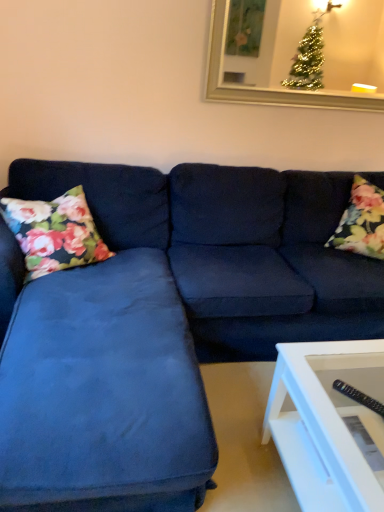
Question: Should I look upward or downward to see floral fabric pillow at left, which ranks as the first pillow in left-to-right order?

Choices:
 (A) up
 (B) down

Answer: (A)

Question: Is suede blue couch at center not inside floral fabric pillow at right, which ranks as the second pillow in left-to-right order?

Choices:
 (A) yes
 (B) no

Answer: (A)

Question: Considering the relative positions of suede blue couch at center and floral fabric pillow at right, which ranks as the second pillow in left-to-right order, in the image provided, is suede blue couch at center behind floral fabric pillow at right, which ranks as the second pillow in left-to-right order,?

Choices:
 (A) yes
 (B) no

Answer: (B)

Question: Would you consider suede blue couch at center to be distant from floral fabric pillow at right, the first pillow viewed from the right?

Choices:
 (A) yes
 (B) no

Answer: (B)

Question: Could floral fabric pillow at right, the first pillow viewed from the right, be considered to be inside suede blue couch at center?

Choices:
 (A) yes
 (B) no

Answer: (A)

Question: Is suede blue couch at center oriented towards floral fabric pillow at right, which ranks as the second pillow in left-to-right order?

Choices:
 (A) yes
 (B) no

Answer: (B)

Question: From a real-world perspective, is suede blue couch at center on top of floral fabric pillow at right, the first pillow viewed from the right?

Choices:
 (A) no
 (B) yes

Answer: (A)

Question: Can you confirm if gold-framed mirror at upper center is thinner than floral fabric pillow at right, which ranks as the second pillow in left-to-right order?

Choices:
 (A) no
 (B) yes

Answer: (B)

Question: Would you say gold-framed mirror at upper center is a long distance from floral fabric pillow at right, which ranks as the second pillow in left-to-right order?

Choices:
 (A) no
 (B) yes

Answer: (B)

Question: Does gold-framed mirror at upper center have a lesser height compared to floral fabric pillow at right, the first pillow viewed from the right?

Choices:
 (A) no
 (B) yes

Answer: (B)

Question: From a real-world perspective, is gold-framed mirror at upper center positioned over floral fabric pillow at right, the first pillow viewed from the right, based on gravity?

Choices:
 (A) no
 (B) yes

Answer: (B)

Question: Is gold-framed mirror at upper center next to floral fabric pillow at right, the first pillow viewed from the right, and touching it?

Choices:
 (A) yes
 (B) no

Answer: (B)

Question: Is gold-framed mirror at upper center taller than floral fabric pillow at right, the first pillow viewed from the right?

Choices:
 (A) yes
 (B) no

Answer: (B)

Question: Considering the relative sizes of floral fabric pillow at left, placed as the 2th pillow when sorted from right to left, and floral fabric pillow at right, the first pillow viewed from the right, in the image provided, is floral fabric pillow at left, placed as the 2th pillow when sorted from right to left, shorter than floral fabric pillow at right, the first pillow viewed from the right,?

Choices:
 (A) yes
 (B) no

Answer: (A)